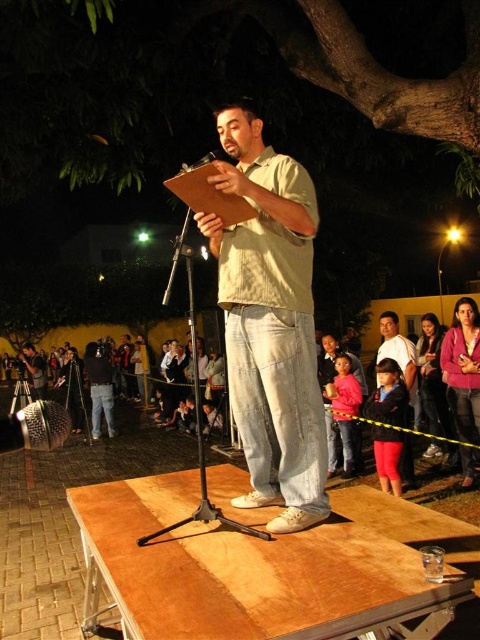
Can you confirm if black fabric dress at lower left is positioned below dark blue jeans at center?

No, black fabric dress at lower left is not below dark blue jeans at center.

Can you confirm if black fabric dress at lower left is bigger than dark blue jeans at center?

No, black fabric dress at lower left is not bigger than dark blue jeans at center.

Does point (71, 406) come in front of point (143, 340)?

Yes, it is in front of point (143, 340).

The height and width of the screenshot is (640, 480). Find the location of `black fabric dress at lower left`. black fabric dress at lower left is located at coordinates (72, 387).

Can you confirm if dark blue jeans at lower left is smaller than black fabric dress at lower left?

Incorrect, dark blue jeans at lower left is not smaller in size than black fabric dress at lower left.

Is dark blue jeans at lower left to the right of black fabric dress at lower left from the viewer's perspective?

Indeed, dark blue jeans at lower left is positioned on the right side of black fabric dress at lower left.

Is point (94, 348) less distant than point (69, 346)?

Yes.

Find the location of a particular element. The height and width of the screenshot is (640, 480). dark blue jeans at lower left is located at coordinates point(99,388).

Is light beige fabric shirt at center below pink sweater at lower right?

Actually, light beige fabric shirt at center is above pink sweater at lower right.

This screenshot has height=640, width=480. What do you see at coordinates (271, 323) in the screenshot?
I see `light beige fabric shirt at center` at bounding box center [271, 323].

Locate an element on the screen. This screenshot has width=480, height=640. light beige fabric shirt at center is located at coordinates (271, 323).